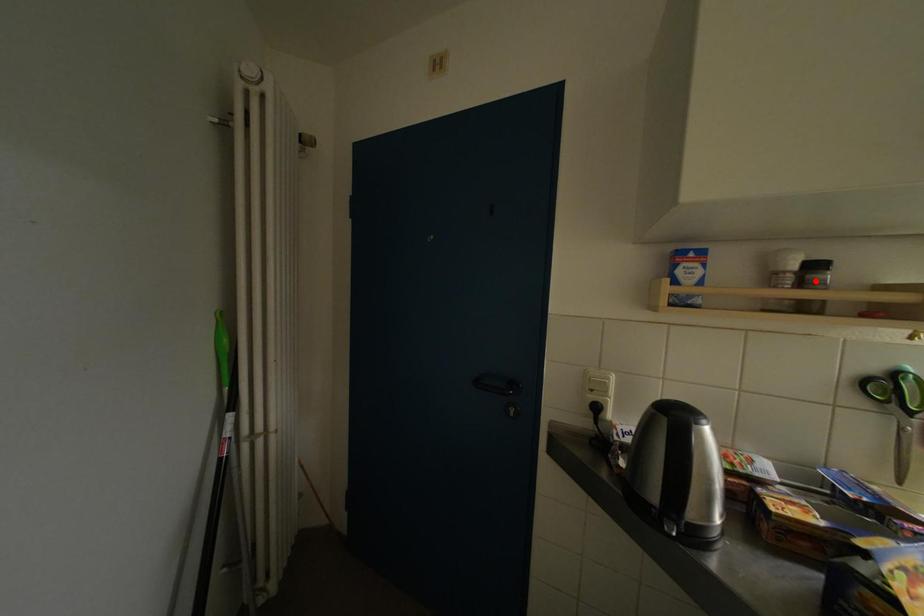
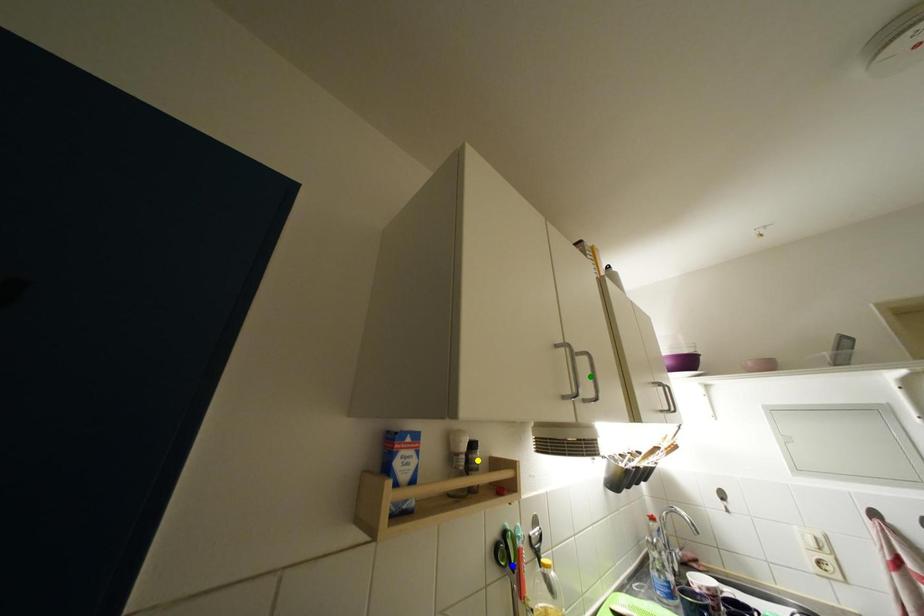
Question: I am providing you with two images of the same scene from different viewpoints. A red point is marked on the first image. You are given multiple points on the second image. Which mark in image 2 goes with the point in image 1?

Choices:
 (A) yellow point
 (B) blue point
 (C) green point

Answer: (A)